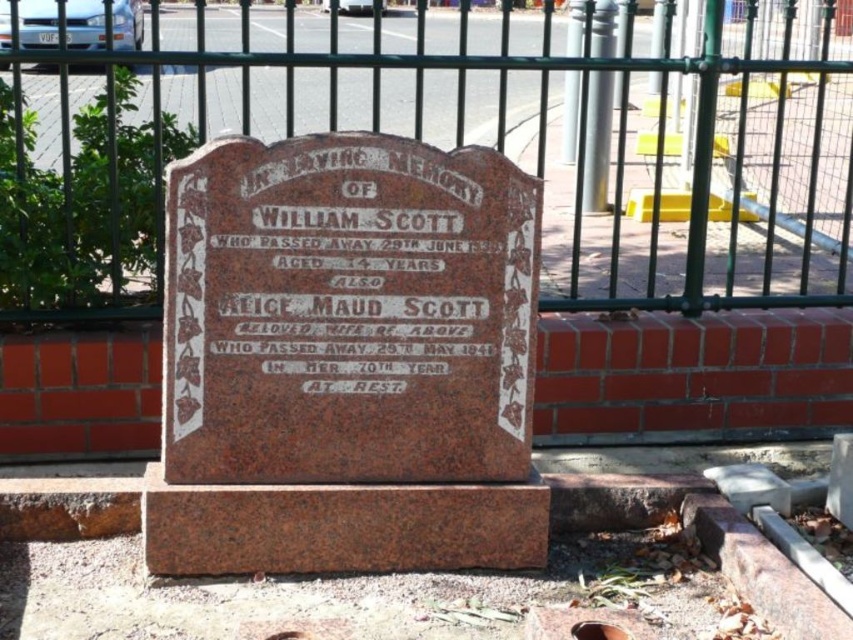
Question: Is green metal fence at upper center positioned in front of white painted stone at center?

Choices:
 (A) no
 (B) yes

Answer: (A)

Question: Among these points, which one is nearest to the camera?

Choices:
 (A) (160, 269)
 (B) (460, 250)

Answer: (B)

Question: Does green metal fence at upper center appear over brown polished stone plaque at center?

Choices:
 (A) yes
 (B) no

Answer: (A)

Question: Is green metal fence at upper center thinner than white painted stone at center?

Choices:
 (A) no
 (B) yes

Answer: (A)

Question: Which point is farther from the camera taking this photo?

Choices:
 (A) (631, 38)
 (B) (260, 320)
 (C) (349, 248)

Answer: (A)

Question: Estimate the real-world distances between objects in this image. Which object is closer to the white painted stone at center?

Choices:
 (A) green metal fence at upper center
 (B) brown polished stone plaque at center

Answer: (B)